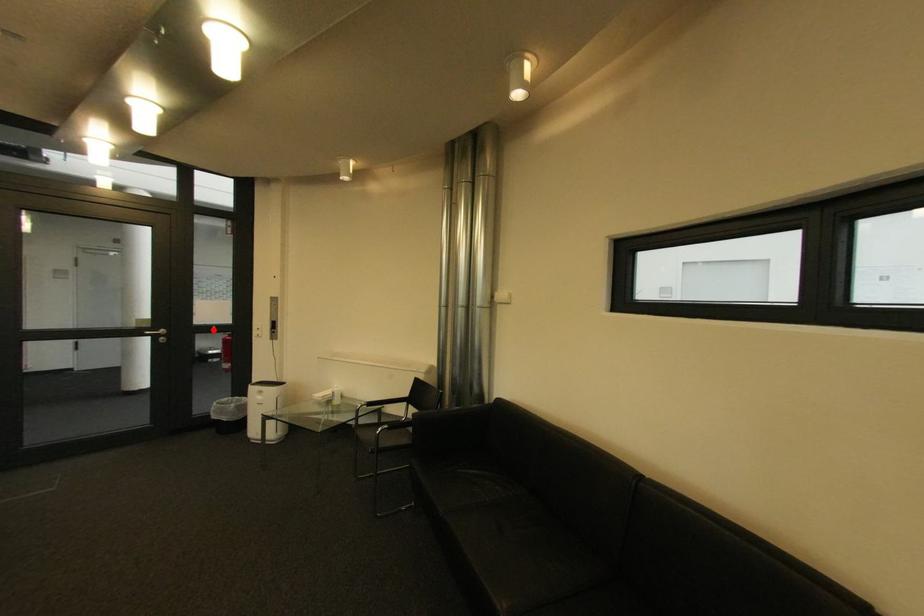
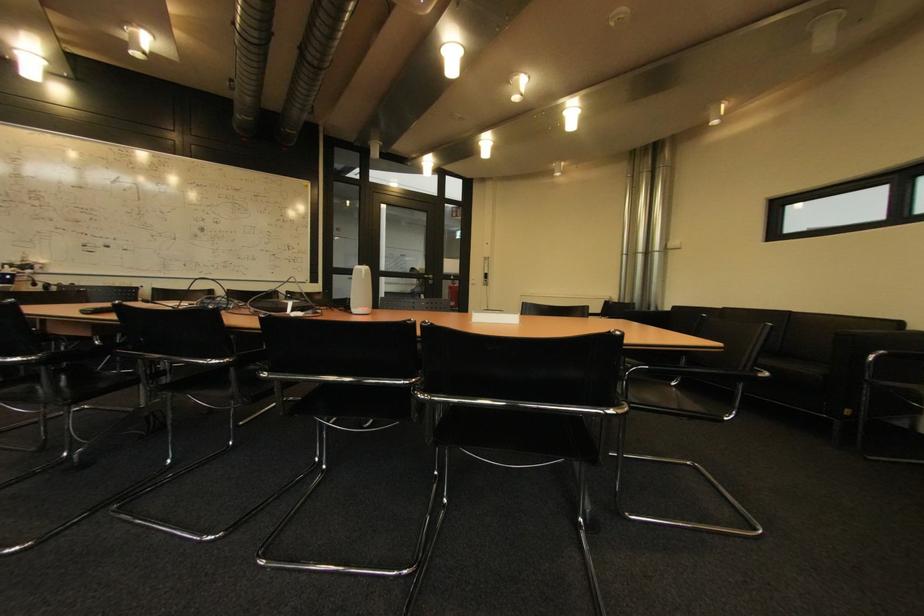
Question: I am providing you with two images of the same scene from different viewpoints. Given a red point in image1, look at the same physical point in image2. Is it:

Choices:
 (A) Closer to the viewpoint
 (B) Farther from the viewpoint

Answer: (A)